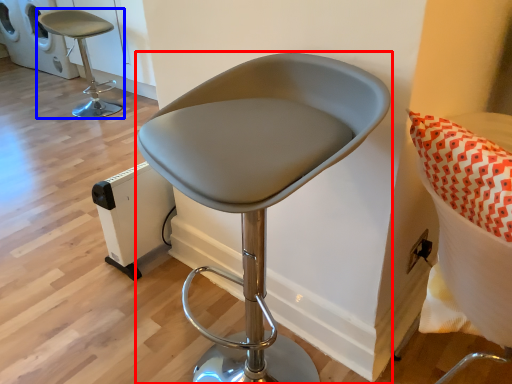
Question: Which of the following is the farthest to the observer, chair (highlighted by a red box) or chair (highlighted by a blue box)?

Choices:
 (A) chair
 (B) chair

Answer: (B)